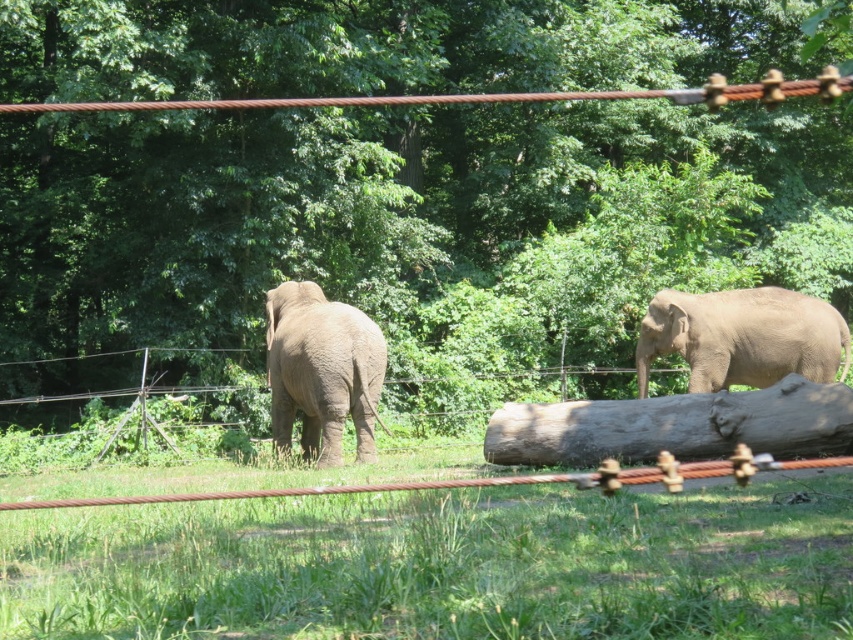
Between gray rough log at center and gray matte elephant at right, which one appears on the left side from the viewer's perspective?

gray rough log at center is more to the left.

In the scene shown: Which is above, gray rough log at center or gray matte elephant at right?

gray matte elephant at right is above.

Which is in front, point (804, 454) or point (757, 371)?

Point (804, 454) is in front.

Image resolution: width=853 pixels, height=640 pixels. I want to click on gray rough log at center, so coord(675,426).

Based on the photo, is green grass at lower center positioned in front of gray matte elephant at right?

Yes, it is.

Looking at this image, does green grass at lower center appear on the right side of gray matte elephant at right?

In fact, green grass at lower center is to the left of gray matte elephant at right.

Is point (590, 557) less distant than point (769, 349)?

Yes, point (590, 557) is in front of point (769, 349).

The height and width of the screenshot is (640, 853). Identify the location of green grass at lower center. (444, 564).

Which is more to the right, green leafy tree at center or green grass at lower center?

green grass at lower center is more to the right.

Is green leafy tree at center smaller than green grass at lower center?

Incorrect, green leafy tree at center is not smaller in size than green grass at lower center.

Where is `green leafy tree at center`? green leafy tree at center is located at coordinates 402,186.